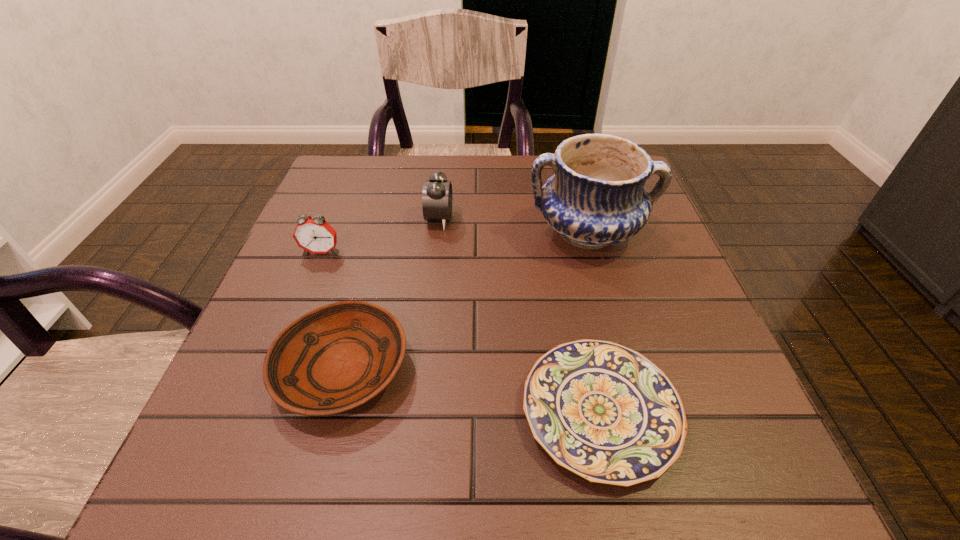
The width and height of the screenshot is (960, 540). In order to click on vacant region located 0.330m on the right of the fourth tallest object in this screenshot , I will do `click(612, 369)`.

Locate an element on the screen. free spot located 0.380m on the back of the right plate is located at coordinates (558, 215).

Find the location of a particular element. object located in the far edge section of the desktop is located at coordinates tap(596, 198).

Image resolution: width=960 pixels, height=540 pixels. What are the coordinates of `object that is at the near edge` in the screenshot? It's located at (605, 412).

The image size is (960, 540). Find the location of `alarm clock that is at the left edge`. alarm clock that is at the left edge is located at coordinates (314, 234).

The height and width of the screenshot is (540, 960). Find the location of `plate at the left edge`. plate at the left edge is located at coordinates (335, 358).

Identify the location of pottery at the right edge. The image size is (960, 540). (596, 198).

The height and width of the screenshot is (540, 960). Find the location of `plate situated at the right edge`. plate situated at the right edge is located at coordinates (605, 412).

The image size is (960, 540). What are the coordinates of `object that is positioned at the far right corner` in the screenshot? It's located at click(x=596, y=198).

Locate an element on the screen. object that is at the near right corner is located at coordinates (605, 412).